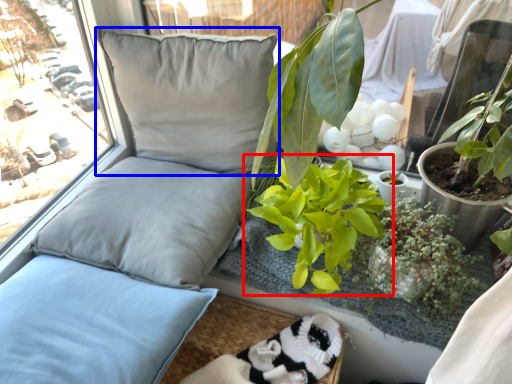
Question: Which object is closer to the camera taking this photo, houseplant (highlighted by a red box) or pillow (highlighted by a blue box)?

Choices:
 (A) houseplant
 (B) pillow

Answer: (A)